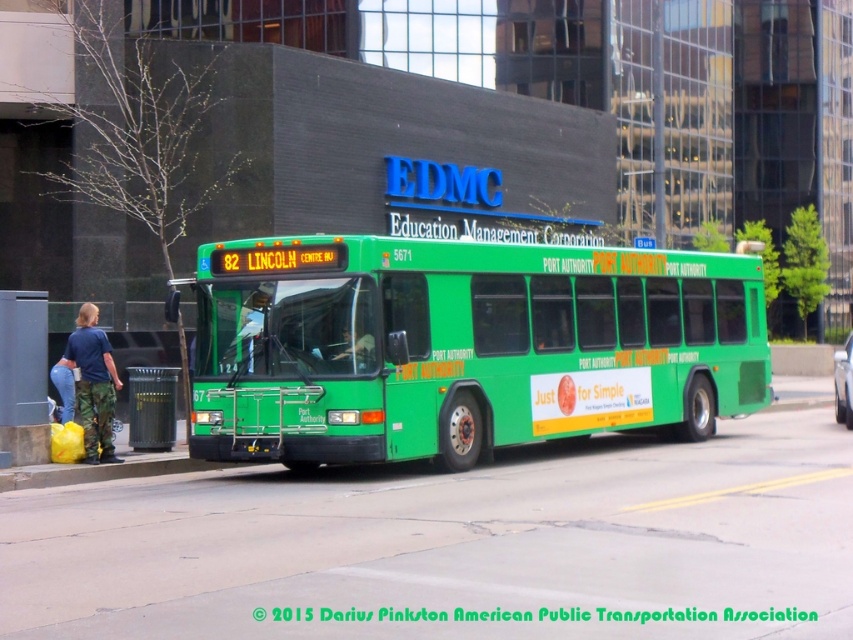
Question: Does metallic gray bus stop at lower left appear on the left side of blue camouflage pants at lower left?

Choices:
 (A) yes
 (B) no

Answer: (A)

Question: Is blue camouflage pants at lower left bigger than concrete at lower left?

Choices:
 (A) no
 (B) yes

Answer: (B)

Question: Which point is closer to the camera?

Choices:
 (A) (22, 426)
 (B) (102, 381)
 (C) (368, 344)
 (D) (576, 298)

Answer: (C)

Question: Does green matte bus at center appear on the right side of metallic gray bus stop at lower left?

Choices:
 (A) yes
 (B) no

Answer: (A)

Question: Which of the following is the farthest from the observer?

Choices:
 (A) (93, 410)
 (B) (363, 358)
 (C) (24, 461)

Answer: (A)

Question: Which is nearer to the blue camouflage pants at lower left?

Choices:
 (A) metallic gray bus stop at lower left
 (B) matte black jacket at center

Answer: (A)